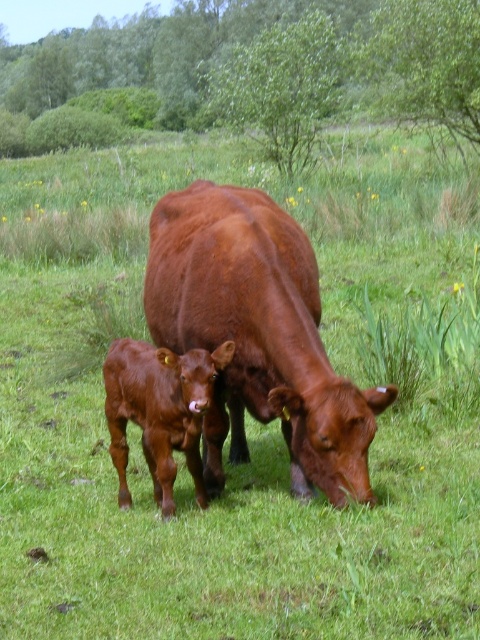
In the scene shown: You are a photographer standing in the field and want to take a picture of both the shiny brown cow at center and the smooth brown calf at center. Which one is positioned higher in the frame?

The shiny brown cow at center is located above the smooth brown calf at center, so it is positioned higher in the frame.

You are standing in the field and want to walk to both points. Which point should you reach first if you walk straight ahead, point (244, 237) or point (156, 476)?

You should reach point (244, 237) first because it is closer to you than point (156, 476).

In the scene shown: You are a farmer who wants to separate the shiny brown cow at center and the smooth brown calf at center into two different pens based on their sizes. Which pen should the larger pen be assigned to?

The shiny brown cow at center is larger in size than the smooth brown calf at center, so the larger pen should be assigned to the shiny brown cow at center.